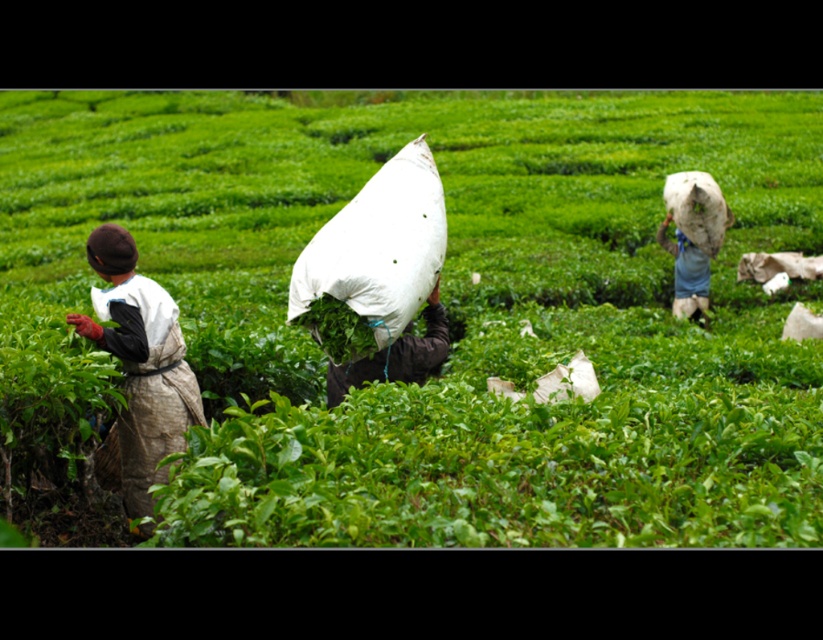
You are a tea picker who wants to choose a bag to carry more tea leaves. You see a green fabric bag at center and a white fabric bag at center. Which bag can hold more tea leaves based on their sizes?

The green fabric bag at center has a greater width than the white fabric bag at center, so it can hold more tea leaves.

From the picture: You are a tea farmer who wants to choose the most spacious container to store more tea leaves. You have two options in front of you in the image, the white fabric bag at center and the white fabric sack at center. Which one should you choose?

The white fabric bag at center has a larger size compared to the white fabric sack at center, so you should choose the white fabric bag at center to store more tea leaves.

You are a photographer taking a picture of the tea plantation scene. You notice the brown fabric apron at left and the white fabric bag at upper right. Which object is positioned lower in the image?

The brown fabric apron at left is positioned below the white fabric bag at upper right, so the brown fabric apron at left is lower.